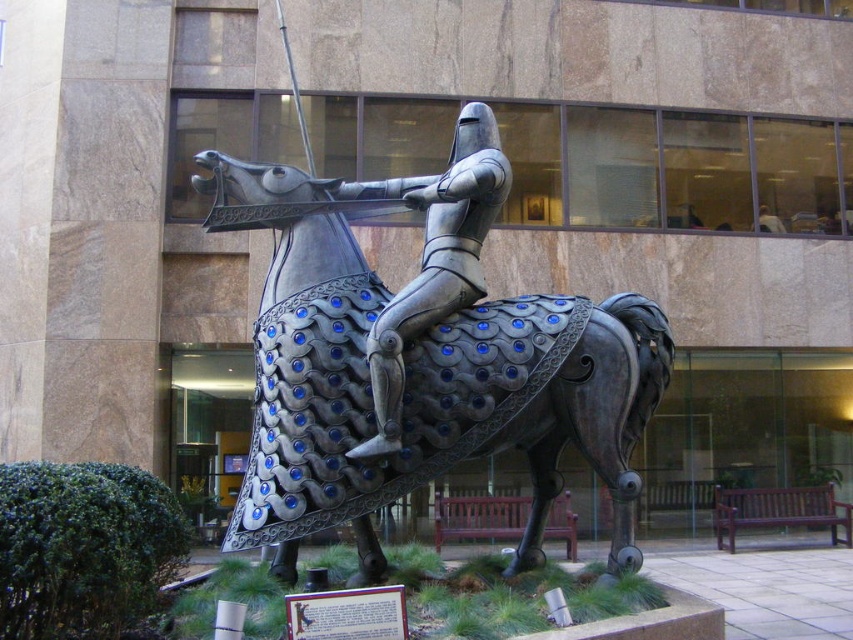
Can you confirm if metallic armor at center is positioned above shiny silver armor at center?

Incorrect, metallic armor at center is not positioned above shiny silver armor at center.

Who is more distant from viewer, (405,291) or (395,193)?

Positioned behind is point (395,193).

In order to click on metallic armor at center in this screenshot , I will do `click(421, 358)`.